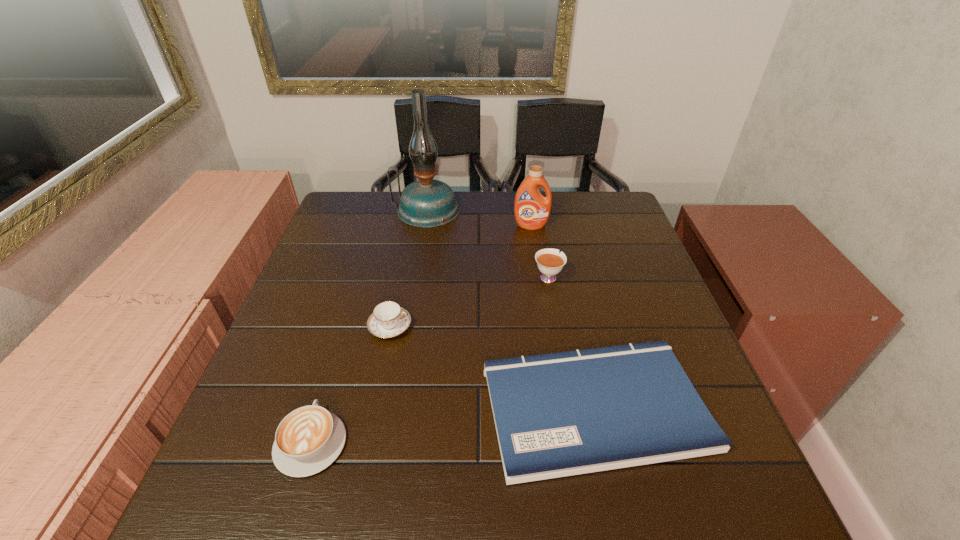
Where is `vacant area that lies between the cappuccino and the shorter teacup`? The image size is (960, 540). vacant area that lies between the cappuccino and the shorter teacup is located at coordinates (350, 384).

Select which object appears as the fourth closest to the cappuccino. Please provide its 2D coordinates. Your answer should be formatted as a tuple, i.e. [(x, y)], where the tuple contains the x and y coordinates of a point satisfying the conditions above.

[(426, 203)]

Locate which object is the second closest to the shortest object. Please provide its 2D coordinates. Your answer should be formatted as a tuple, i.e. [(x, y)], where the tuple contains the x and y coordinates of a point satisfying the conditions above.

[(549, 261)]

Find the location of a particular element. This screenshot has width=960, height=540. vacant space that satisfies the following two spatial constraints: 1. on the side with the handle of the shortest object; 2. on the right side of the nearer teacup is located at coordinates (373, 408).

The image size is (960, 540). Find the location of `free spot that satisfies the following two spatial constraints: 1. on the front-facing side of the detergent; 2. on the left side of the shortest object`. free spot that satisfies the following two spatial constraints: 1. on the front-facing side of the detergent; 2. on the left side of the shortest object is located at coordinates point(559,408).

The height and width of the screenshot is (540, 960). Find the location of `vacant space that satisfies the following two spatial constraints: 1. on the side with the handle of the left teacup; 2. on the back side of the paperback book`. vacant space that satisfies the following two spatial constraints: 1. on the side with the handle of the left teacup; 2. on the back side of the paperback book is located at coordinates (373, 408).

You are a GUI agent. You are given a task and a screenshot of the screen. Output one action in this format:
    pyautogui.click(x=<x>, y=<y>)
    Task: Click on the free spot that satisfies the following two spatial constraints: 1. on the front-facing side of the fifth shortest object; 2. on the right side of the shortest object
    The width and height of the screenshot is (960, 540).
    Given the screenshot: What is the action you would take?
    pyautogui.click(x=559, y=408)

Locate an element on the screen. Image resolution: width=960 pixels, height=540 pixels. free space that satisfies the following two spatial constraints: 1. on the side of the cappuccino with the handle; 2. on the right side of the paperback book is located at coordinates (322, 408).